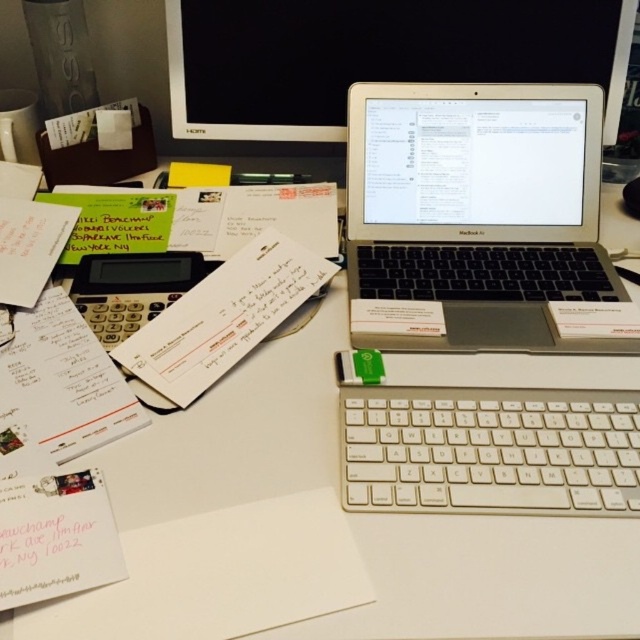
Question: Which of the following is the farthest from the observer?

Choices:
 (A) (278, 3)
 (B) (209, 164)
 (C) (540, 406)

Answer: (B)

Question: Which is nearer to the silver metallic laptop at center?

Choices:
 (A) white plastic keyboard at center
 (B) yellow paper at upper center

Answer: (A)

Question: Is silver metallic laptop at center below satin black monitor at upper center?

Choices:
 (A) yes
 (B) no

Answer: (A)

Question: Can you confirm if satin black monitor at upper center is smaller than yellow paper at upper center?

Choices:
 (A) no
 (B) yes

Answer: (A)

Question: Which of these objects is positioned closest to the silver metallic laptop at center?

Choices:
 (A) white plastic keyboard at center
 (B) yellow paper at upper center

Answer: (A)

Question: Does satin black monitor at upper center appear on the left side of white plastic keyboard at center?

Choices:
 (A) no
 (B) yes

Answer: (B)